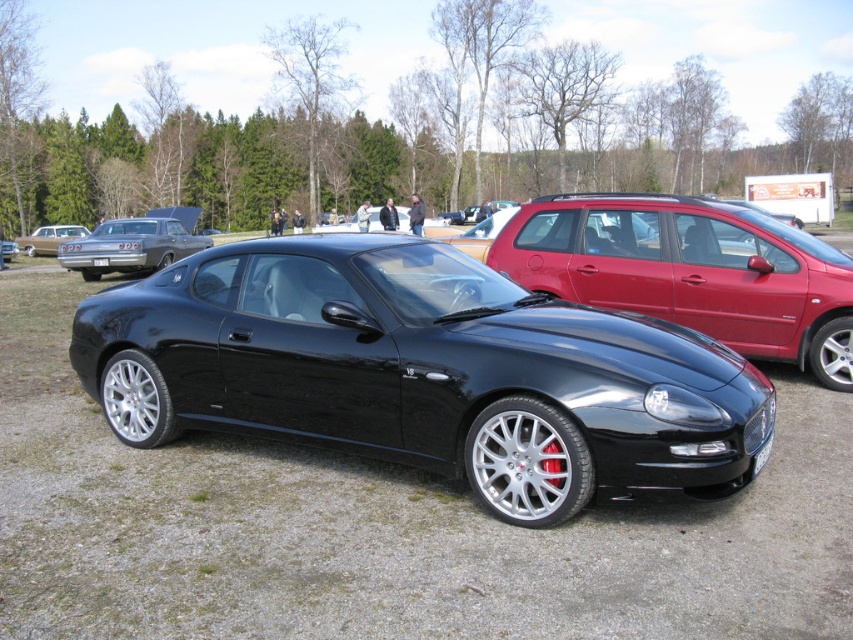
Looking at this image, you are a driver who needs to check the license plates of the Maserati. Which license plate is wider, the white plastic license plate at front or the white plastic license plate at center?

The white plastic license plate at center is wider than the white plastic license plate at front.

You are a photographer standing at the location of the black metallic sports car at center. You want to take a photo of the matte silver sedan at upper left without any obstructions. Given that your telephoto lens has a maximum range of 15 meters, will you be able to capture a clear shot?

The distance between the black metallic sports car at center and the matte silver sedan at upper left is 14.87 meters, which is within the telephoto lens range of 15 meters. Therefore, you can capture a clear shot without obstructions.

You are a photographer trying to capture both the black metallic sports car at center and the matte silver classic car at left in a single shot. Based on their positions, which car should you focus on first to ensure both are in frame?

The black metallic sports car at center is below the matte silver classic car at left, so you should focus on the matte silver classic car at left first to ensure both are in frame.